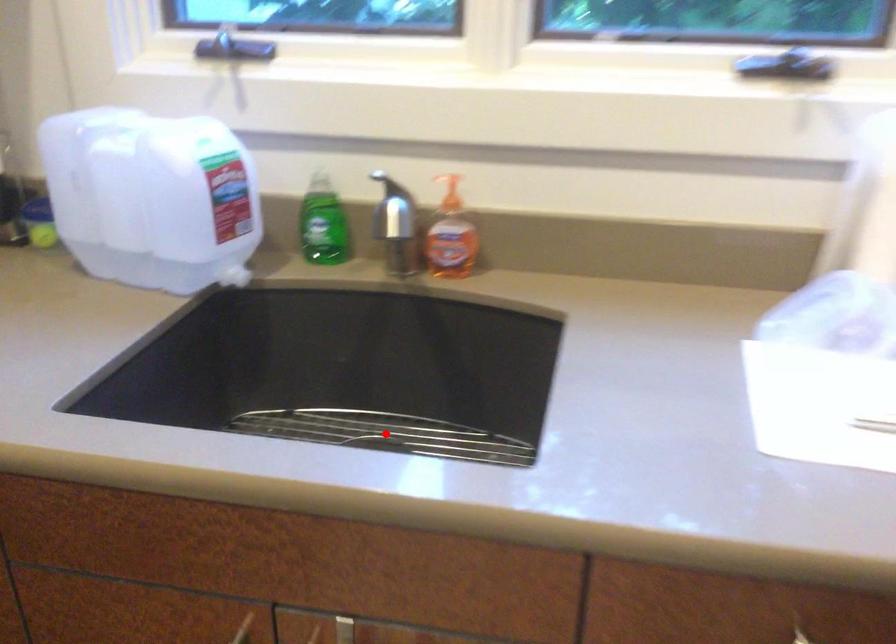
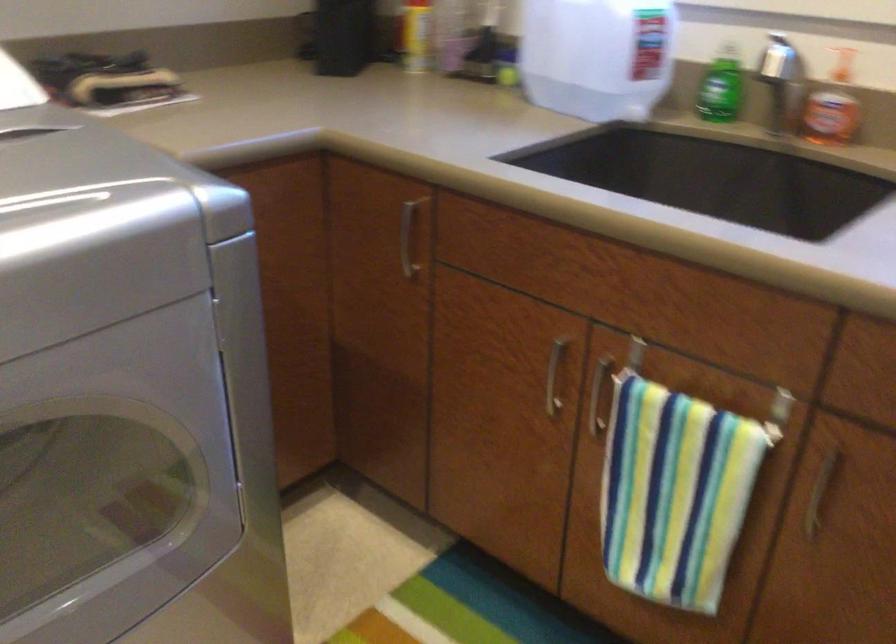
Question: I am providing you with two images of the same scene from different viewpoints. A red point is marked on the first image. Is the red point's position out of view in image 2?

Choices:
 (A) Yes
 (B) No

Answer: (A)